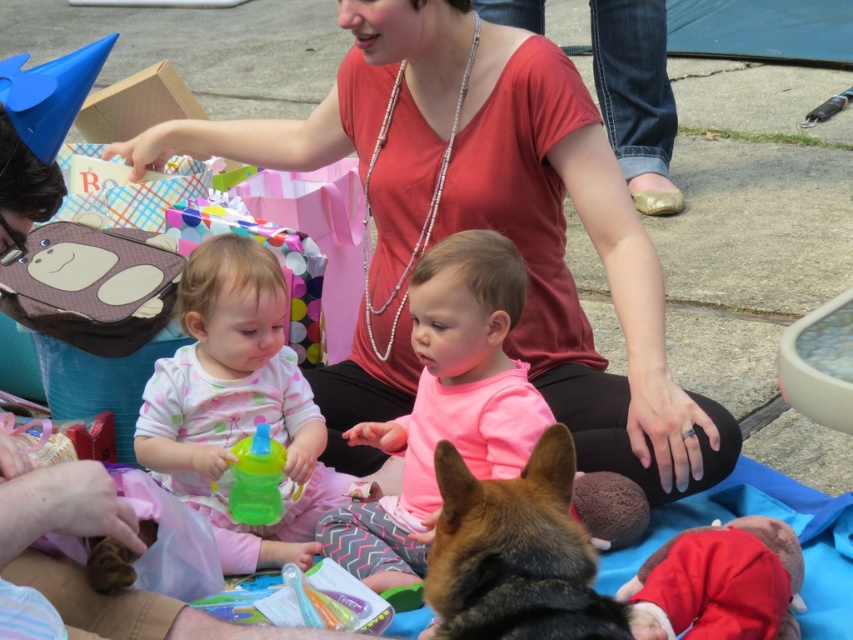
Question: Estimate the real-world distances between objects in this image. Which object is closer to the pink fabric dress at center?

Choices:
 (A) pink matte shirt at center
 (B) brown fur dog at lower center

Answer: (A)

Question: Does pink matte shirt at center have a lesser width compared to brown fur dog at lower center?

Choices:
 (A) no
 (B) yes

Answer: (A)

Question: Does pink matte shirt at center lie behind translucent plastic sippy cup at center?

Choices:
 (A) no
 (B) yes

Answer: (A)

Question: Which point is farther from the camera taking this photo?

Choices:
 (A) (474, 365)
 (B) (334, 493)
 (C) (514, 545)

Answer: (B)

Question: Can you confirm if brown fur dog at lower center is wider than translucent plastic sippy cup at center?

Choices:
 (A) yes
 (B) no

Answer: (A)

Question: Which object is farther from the camera taking this photo?

Choices:
 (A) pink matte shirt at center
 (B) pink fabric dress at center

Answer: (B)